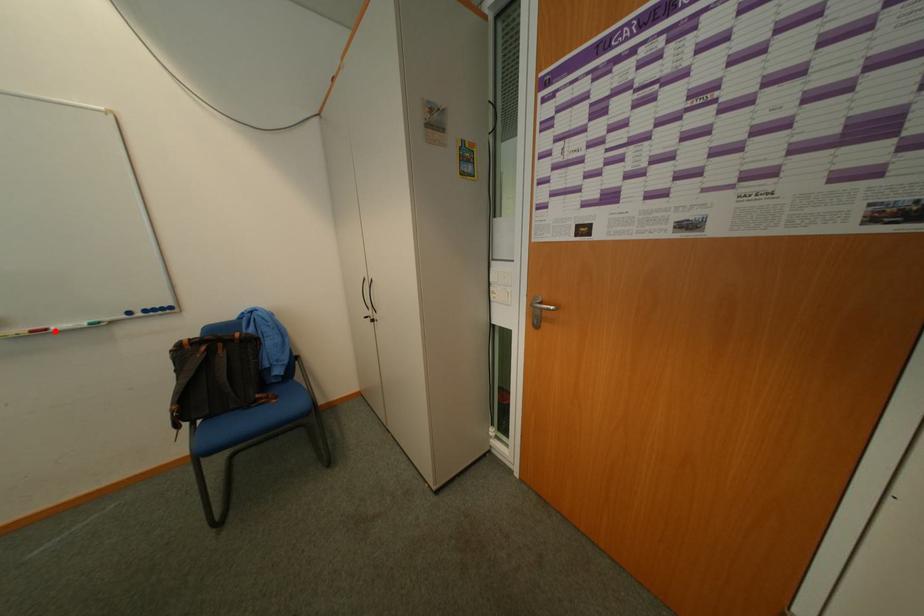
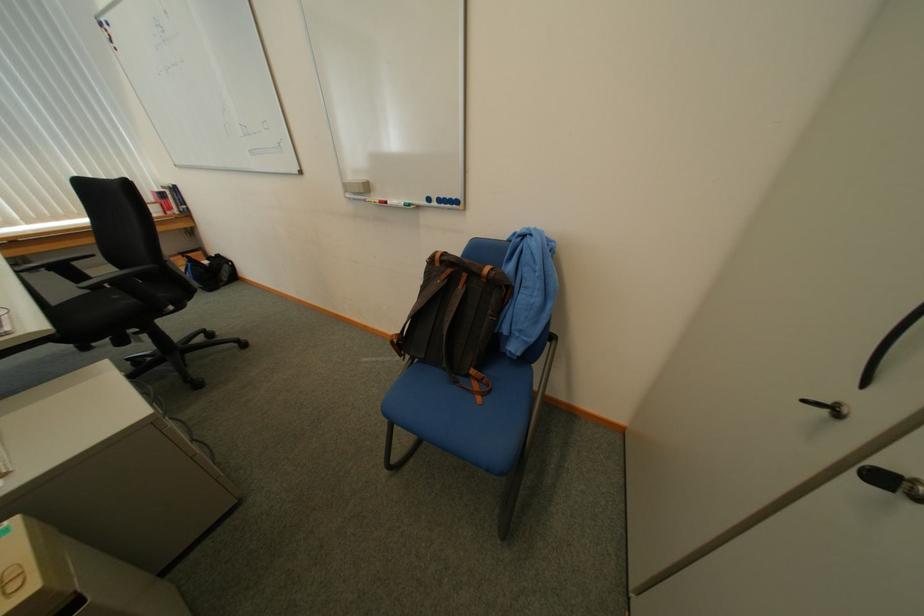
Locate, in the second image, the point that corresponds to the highlighted location in the first image.

(396, 204)